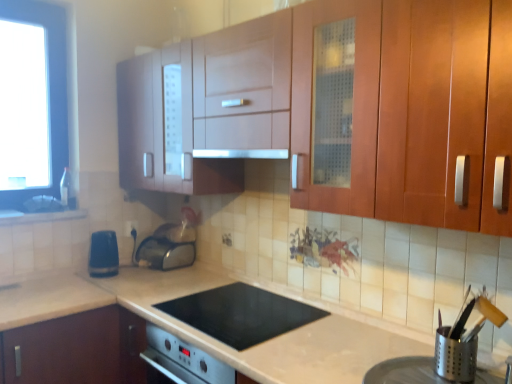
What do you see at coordinates (165, 253) in the screenshot? I see `satin silver toaster at lower center, which is the third appliance in right-to-left order` at bounding box center [165, 253].

Locate an element on the screen. black glass cooktop at center is located at coordinates (241, 314).

This screenshot has height=384, width=512. What do you see at coordinates (103, 254) in the screenshot? I see `blue plastic kettle at lower left, which appears as the 3th appliance when viewed from the front` at bounding box center [103, 254].

What do you see at coordinates (44, 204) in the screenshot? I see `white glossy sink at lower left` at bounding box center [44, 204].

Image resolution: width=512 pixels, height=384 pixels. Identify the location of silver metallic utensil holder at lower right, which is counted as the second appliance, starting from the right. (420, 373).

The image size is (512, 384). In order to click on satin silver toaster at lower center, arranged as the 1th appliance when viewed from the back in this screenshot , I will do `click(165, 253)`.

In the image, there is a satin silver toaster at lower center, arranged as the 1th appliance when viewed from the back. Where is `gas stove below it (from a real-world perspective)`? This screenshot has height=384, width=512. gas stove below it (from a real-world perspective) is located at coordinates [241, 314].

Who is more distant, black glass cooktop at center or satin silver toaster at lower center, the 2th appliance when ordered from left to right?

satin silver toaster at lower center, the 2th appliance when ordered from left to right, is further from the camera.

Are black glass cooktop at center and satin silver toaster at lower center, positioned as the fourth appliance in front-to-back order, far apart?

No, there isn't a large distance between black glass cooktop at center and satin silver toaster at lower center, positioned as the fourth appliance in front-to-back order.

Which object is wider, black glass cooktop at center or satin silver toaster at lower center, which is the third appliance in right-to-left order?

Wider between the two is black glass cooktop at center.

Considering the positions of objects black glass cooktop at center and blue plastic electric outlet at lower left in the image provided, who is in front, black glass cooktop at center or blue plastic electric outlet at lower left?

black glass cooktop at center is in front.

Which is more to the left, black glass cooktop at center or blue plastic electric outlet at lower left?

blue plastic electric outlet at lower left.

Between black glass cooktop at center and blue plastic electric outlet at lower left, which one has larger size?

black glass cooktop at center.

How much distance is there between black glass cooktop at center and blue plastic electric outlet at lower left?

black glass cooktop at center is 1.12 meters from blue plastic electric outlet at lower left.

What's the angular difference between white glossy sink at lower left and silver metallic utensil holder at lower right, the first appliance positioned from the front,'s facing directions?

There is a 91.4-degree angle between the facing directions of white glossy sink at lower left and silver metallic utensil holder at lower right, the first appliance positioned from the front.

In the image, is white glossy sink at lower left on the left side or the right side of silver metallic utensil holder at lower right, which is counted as the second appliance, starting from the right?

In the image, white glossy sink at lower left appears on the left side of silver metallic utensil holder at lower right, which is counted as the second appliance, starting from the right.

Who is bigger, white glossy sink at lower left or silver metallic utensil holder at lower right, the third appliance positioned from the left?

Bigger between the two is silver metallic utensil holder at lower right, the third appliance positioned from the left.

From a real-world perspective, who is located lower, white glossy sink at lower left or silver metallic utensil holder at lower right, which is counted as the second appliance, starting from the right?

In real-world perspective, silver metallic utensil holder at lower right, which is counted as the second appliance, starting from the right, is lower.

Can you confirm if silver metallic utensil holder at lower right, the 2th appliance from the front, is wider than white glossy sink at lower left?

Incorrect, the width of silver metallic utensil holder at lower right, the 2th appliance from the front, does not surpass that of white glossy sink at lower left.

Is silver metallic utensil holder at lower right, which appears as the third appliance when viewed from the back, situated inside white glossy sink at lower left or outside?

silver metallic utensil holder at lower right, which appears as the third appliance when viewed from the back, cannot be found inside white glossy sink at lower left.

Where is `sink behind the silver metallic utensil holder at lower right, which is counted as the second appliance, starting from the right`? The image size is (512, 384). sink behind the silver metallic utensil holder at lower right, which is counted as the second appliance, starting from the right is located at coordinates (44, 204).

Based on the photo, is silver metallic utensil holder at lower right, the third appliance positioned from the left, next to white glossy sink at lower left and touching it?

No, silver metallic utensil holder at lower right, the third appliance positioned from the left, is not beside white glossy sink at lower left.

Can you confirm if silver metallic utensil holder at lower right, which is the 4th appliance in back-to-front order, is positioned to the left of white glossy sink at lower left?

Incorrect, silver metallic utensil holder at lower right, which is the 4th appliance in back-to-front order, is not on the left side of white glossy sink at lower left.

Can satin silver exhaust hood at center be found inside blue plastic electric outlet at lower left?

No, satin silver exhaust hood at center is not inside blue plastic electric outlet at lower left.

Which object is positioned more to the left, blue plastic electric outlet at lower left or satin silver exhaust hood at center?

blue plastic electric outlet at lower left.

Could you measure the distance between blue plastic electric outlet at lower left and satin silver exhaust hood at center?

They are 1.08 meters apart.

From a real-world perspective, is satin silver toaster at lower center, arranged as the 1th appliance when viewed from the back, positioned above or below white glossy countertop at center?

satin silver toaster at lower center, arranged as the 1th appliance when viewed from the back, is situated higher than white glossy countertop at center in the real world.

Is satin silver toaster at lower center, positioned as the fourth appliance in front-to-back order, positioned with its back to white glossy countertop at center?

satin silver toaster at lower center, positioned as the fourth appliance in front-to-back order, does not have its back to white glossy countertop at center.

Looking at this image, which point is more forward, (161, 239) or (367, 347)?

The point (367, 347) is closer.

How far apart are satin silver toaster at lower center, the 2th appliance when ordered from left to right, and white glossy countertop at center?

A distance of 21.20 inches exists between satin silver toaster at lower center, the 2th appliance when ordered from left to right, and white glossy countertop at center.

Starting from the black glass cooktop at center, which appliance is the 2nd one behind? Please provide its 2D coordinates.

[(165, 253)]

In order to click on gas stove located on the right of blue plastic electric outlet at lower left in this screenshot , I will do `click(241, 314)`.

Consider the image. Estimate the real-world distances between objects in this image. Which object is further from silver metallic utensil holder at lower right, placed as the 4th appliance when sorted from left to right, black glass cooktop at center or matte wood cabinet at upper center?

matte wood cabinet at upper center is further to silver metallic utensil holder at lower right, placed as the 4th appliance when sorted from left to right.

From the image, which object appears to be nearer to silver metallic utensil holder at lower right, the third appliance positioned from the left, satin silver toaster at lower center, arranged as the 1th appliance when viewed from the back, or white glossy countertop at center?

white glossy countertop at center lies closer to silver metallic utensil holder at lower right, the third appliance positioned from the left, than the other object.

When comparing their distances from white glossy countertop at center, does blue plastic electric outlet at lower left or satin silver toaster at lower center, arranged as the 1th appliance when viewed from the back, seem closer?

satin silver toaster at lower center, arranged as the 1th appliance when viewed from the back, is positioned closer to the anchor white glossy countertop at center.

Considering their positions, is matte wood cabinet at upper center positioned closer to black glass cooktop at center than white glossy sink at lower left?

Among the two, matte wood cabinet at upper center is located nearer to black glass cooktop at center.

Considering their positions, is matte wood cabinet at upper center positioned further to blue plastic electric outlet at lower left than black glass cooktop at center?

matte wood cabinet at upper center lies further to blue plastic electric outlet at lower left than the other object.

Considering their positions, is silver metallic utensil holder at lower right, the first appliance positioned from the front, positioned further to satin silver toaster at lower center, the 2th appliance when ordered from left to right, than blue plastic electric outlet at lower left?

silver metallic utensil holder at lower right, the first appliance positioned from the front, is positioned further to the anchor satin silver toaster at lower center, the 2th appliance when ordered from left to right.

Looking at the image, which one is located further to matte wood cabinet at upper center, black glass cooktop at center or white glossy sink at lower left?

white glossy sink at lower left is further to matte wood cabinet at upper center.

Estimate the real-world distances between objects in this image. Which object is closer to silver metallic utensil holder at lower right, the 2th appliance from the front, silver metallic utensil holder at lower right, the third appliance positioned from the left, or white glossy sink at lower left?

Based on the image, silver metallic utensil holder at lower right, the third appliance positioned from the left, appears to be nearer to silver metallic utensil holder at lower right, the 2th appliance from the front.

I want to click on exhaust hood between satin silver toaster at lower center, positioned as the fourth appliance in front-to-back order, and silver metallic utensil holder at lower right, which appears as the third appliance when viewed from the back, so click(241, 153).

Identify the location of exhaust hood between silver metallic utensil holder at lower right, which appears as the third appliance when viewed from the back, and blue plastic electric outlet at lower left from front to back. (241, 153).

The image size is (512, 384). Find the location of `gas stove between white glossy sink at lower left and silver metallic utensil holder at lower right, the third appliance positioned from the left`. gas stove between white glossy sink at lower left and silver metallic utensil holder at lower right, the third appliance positioned from the left is located at coordinates (241, 314).

This screenshot has width=512, height=384. What are the coordinates of `sink between white glossy countertop at center and satin silver toaster at lower center, which is the third appliance in right-to-left order, along the z-axis` in the screenshot? It's located at (44, 204).